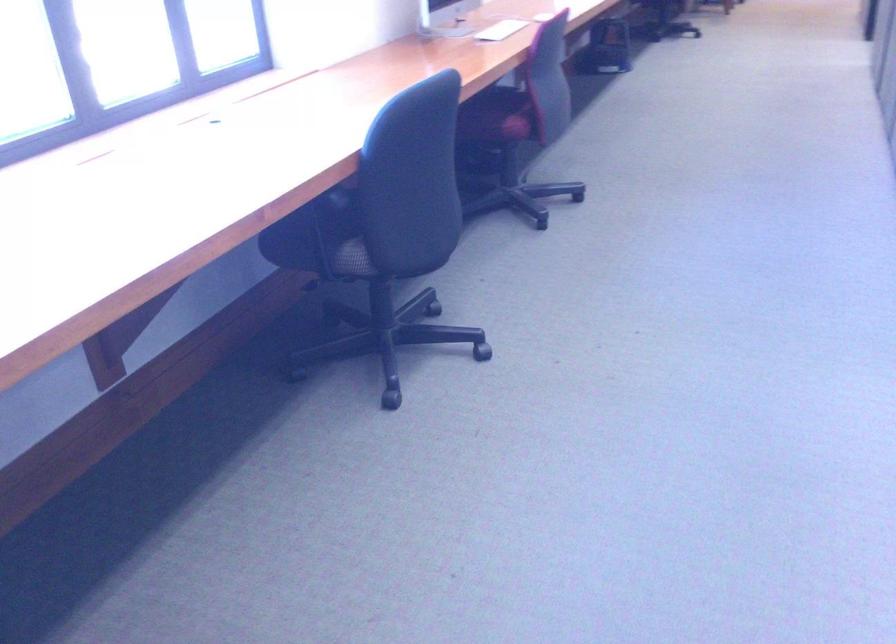
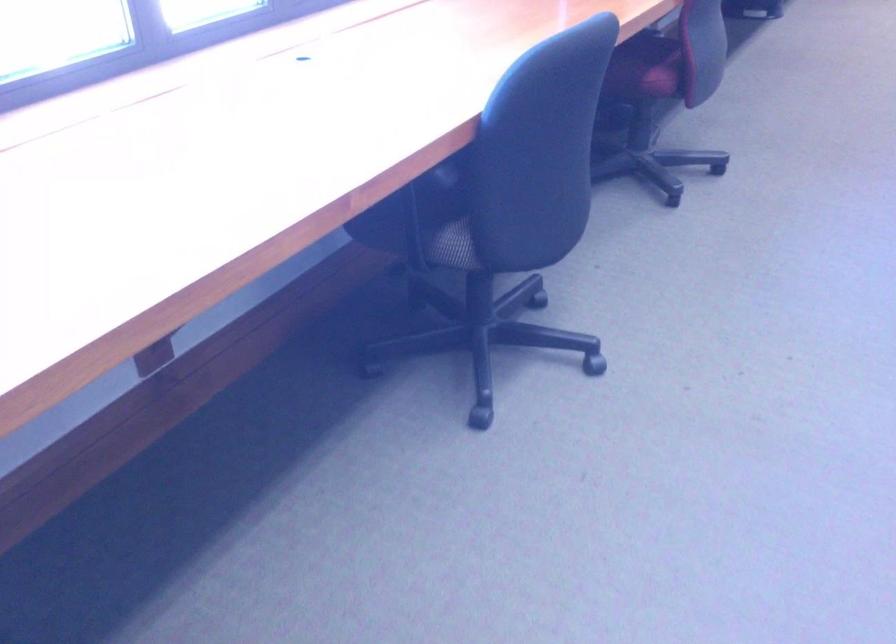
Question: Which direction would the cameraman need to move to produce the second image? Reply with the corresponding letter.

Choices:
 (A) Left
 (B) Right
 (C) Forward
 (D) Backward

Answer: (C)